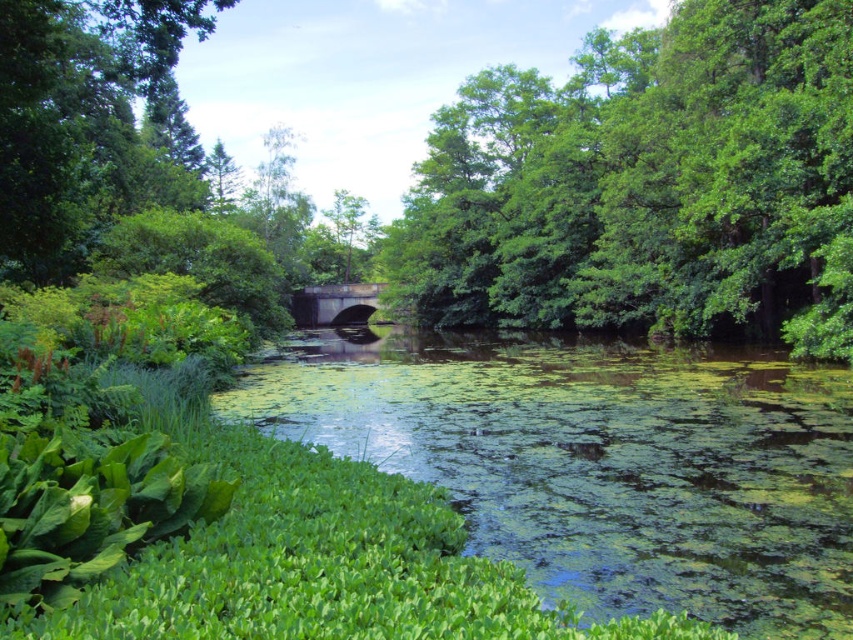
Question: Is green leafy tree at upper center below concrete bridge at center?

Choices:
 (A) yes
 (B) no

Answer: (B)

Question: Is green leafy tree at upper center thinner than green leafy tree at center?

Choices:
 (A) yes
 (B) no

Answer: (B)

Question: Is green algae-covered water at center below green leafy tree at center?

Choices:
 (A) no
 (B) yes

Answer: (B)

Question: Which of the following is the closest to the observer?

Choices:
 (A) green leafy tree at center
 (B) green algae-covered water at center

Answer: (B)

Question: Which object appears closest to the camera in this image?

Choices:
 (A) green leafy tree at center
 (B) green algae-covered water at center
 (C) green leafy tree at upper center
 (D) concrete bridge at center

Answer: (B)

Question: Which point is closer to the camera taking this photo?

Choices:
 (A) (349, 275)
 (B) (370, 282)
 (C) (692, 508)

Answer: (C)